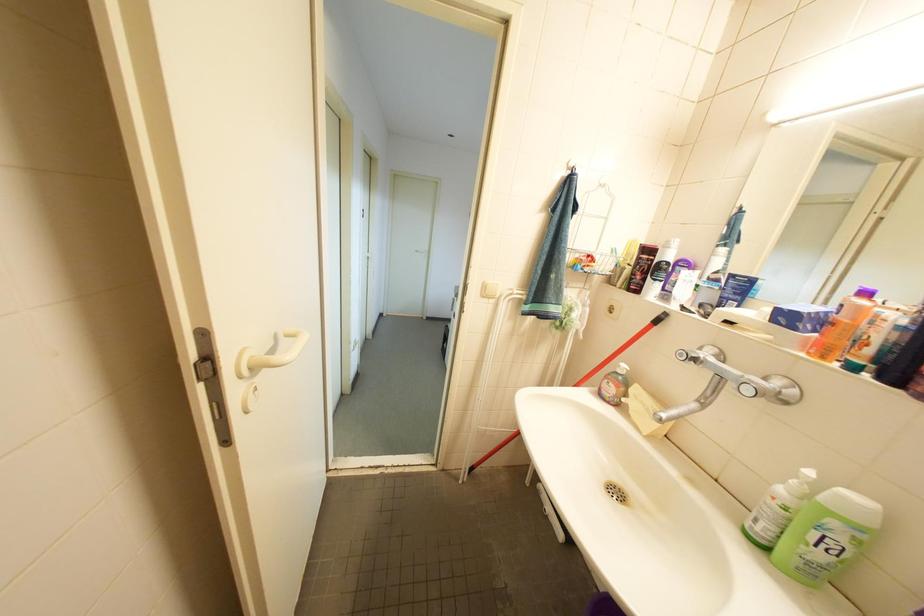
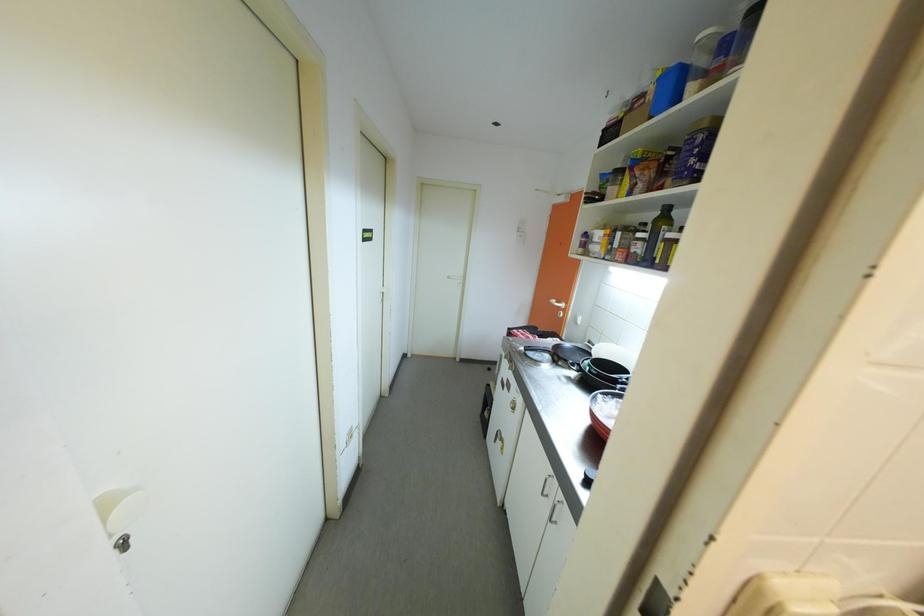
Question: What movement of the cameraman would produce the second image?

Choices:
 (A) Left
 (B) Right
 (C) Forward
 (D) Backward

Answer: (C)